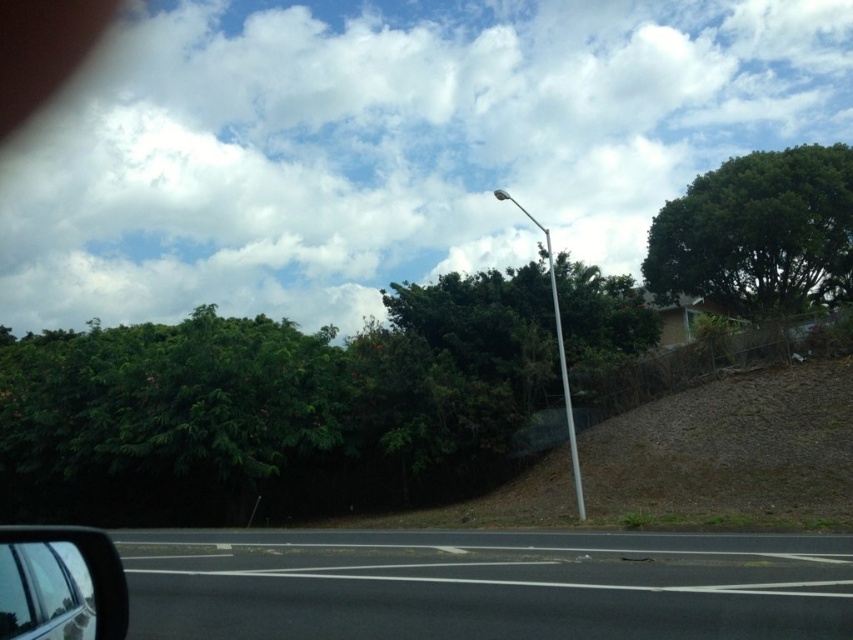
Who is positioned more to the right, green leafy tree at center or green leafy tree at upper right?

green leafy tree at upper right

Who is higher up, green leafy tree at center or green leafy tree at upper right?

green leafy tree at upper right is higher up.

Where is `green leafy tree at center`? This screenshot has height=640, width=853. green leafy tree at center is located at coordinates (276, 406).

Who is taller, green leafy tree at center or white metallic pole at center?

white metallic pole at center

Is point (65, 512) closer to viewer compared to point (569, 412)?

That is False.

Who is more forward, (x=245, y=435) or (x=553, y=310)?

Point (x=245, y=435)

I want to click on green leafy tree at center, so pyautogui.click(x=276, y=406).

Is black asphalt road at center further to camera compared to white metallic pole at center?

That is False.

Which is more to the left, black asphalt road at center or white metallic pole at center?

From the viewer's perspective, black asphalt road at center appears more on the left side.

Which is in front, point (750, 611) or point (549, 280)?

Point (750, 611) is more forward.

Locate an element on the screen. The image size is (853, 640). black asphalt road at center is located at coordinates (486, 586).